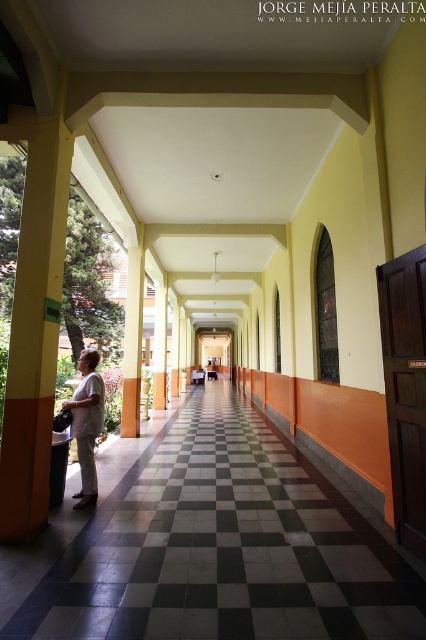
Question: Does yellow painted wood column at left appear on the left side of white matte shirt at center?

Choices:
 (A) yes
 (B) no

Answer: (A)

Question: Which object is farther from the camera taking this photo?

Choices:
 (A) orange matte pillar at center
 (B) black tile corridor at center

Answer: (A)

Question: Which object is farther from the camera taking this photo?

Choices:
 (A) orange matte pillar at center
 (B) yellow painted wood column at left

Answer: (A)

Question: Which point is farther to the camera?

Choices:
 (A) orange matte pillar at center
 (B) orange painted pillar at center

Answer: (A)

Question: Is orange painted pillar at center bigger than orange matte pillar at center?

Choices:
 (A) no
 (B) yes

Answer: (A)

Question: Does black tile corridor at center come in front of orange painted pillar at center?

Choices:
 (A) yes
 (B) no

Answer: (A)